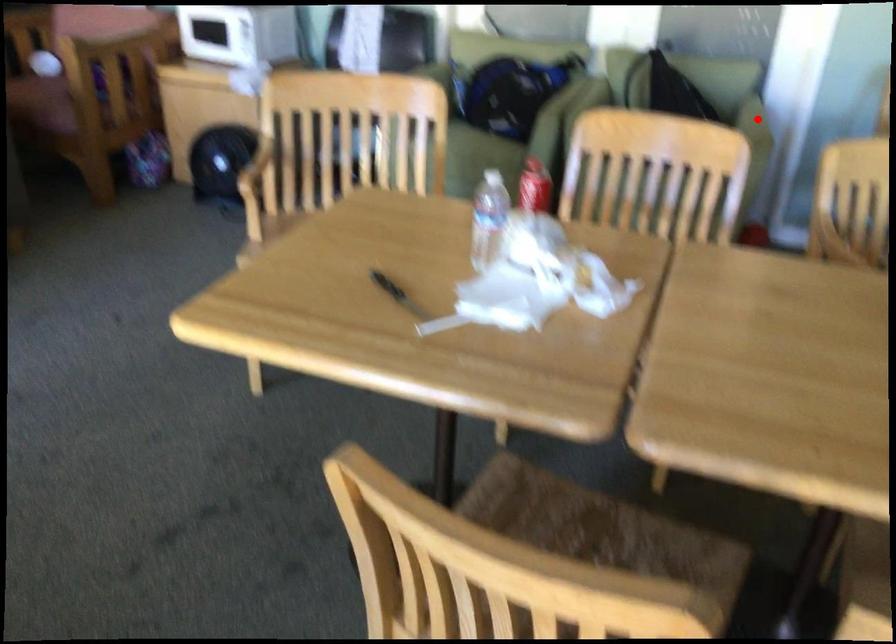
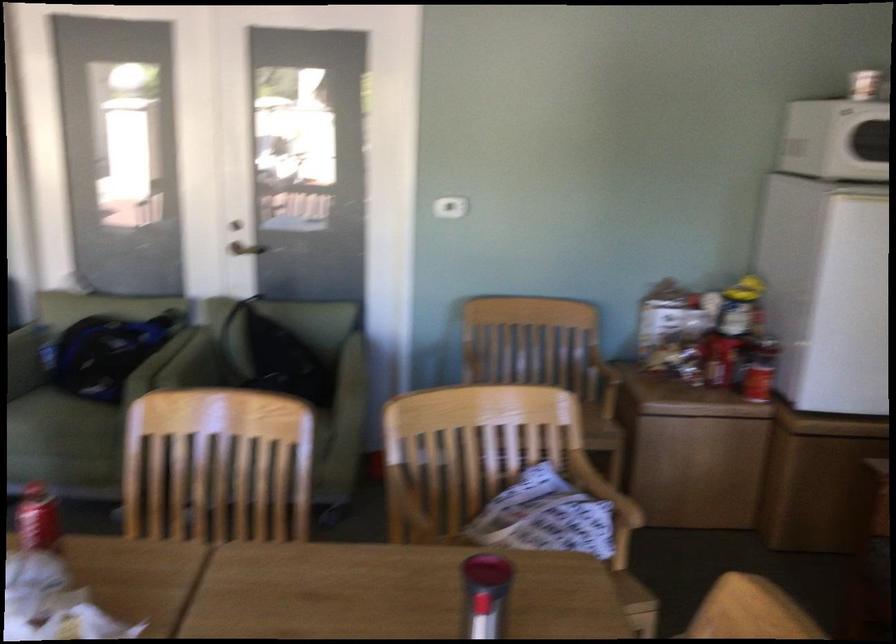
Find the pixel in the second image that matches the highlighted location in the first image.

(354, 365)